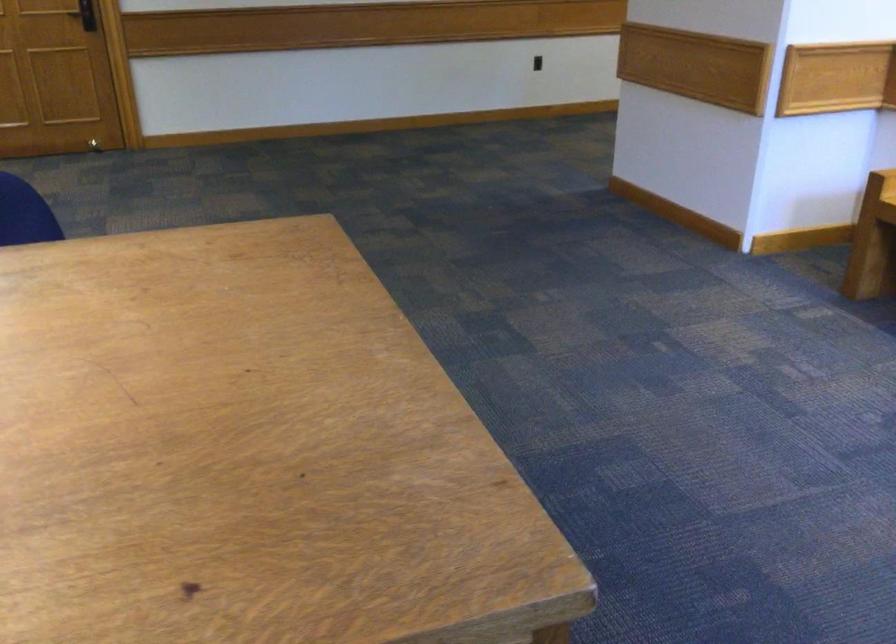
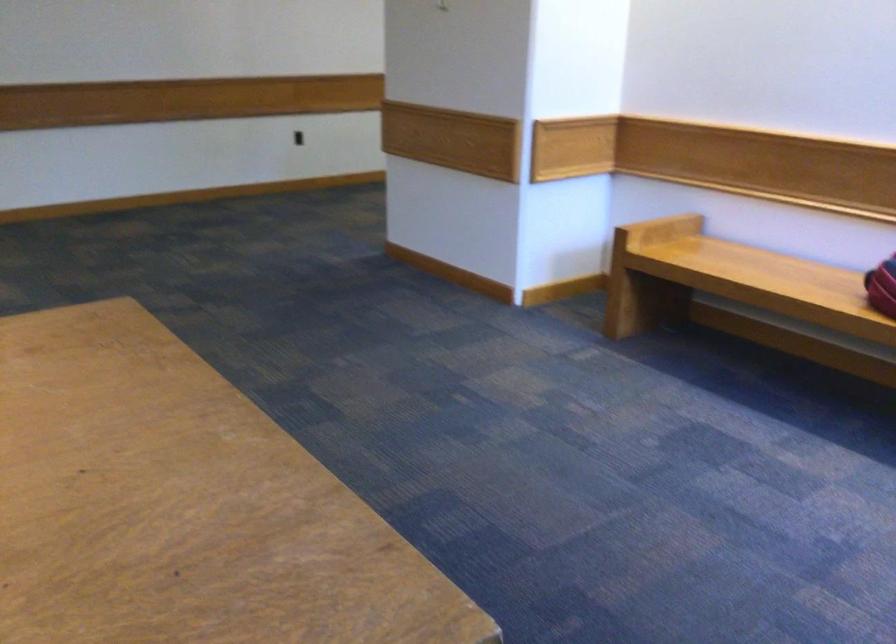
Which direction would the cameraman need to move to produce the second image?

The cameraman walked toward left, backward.